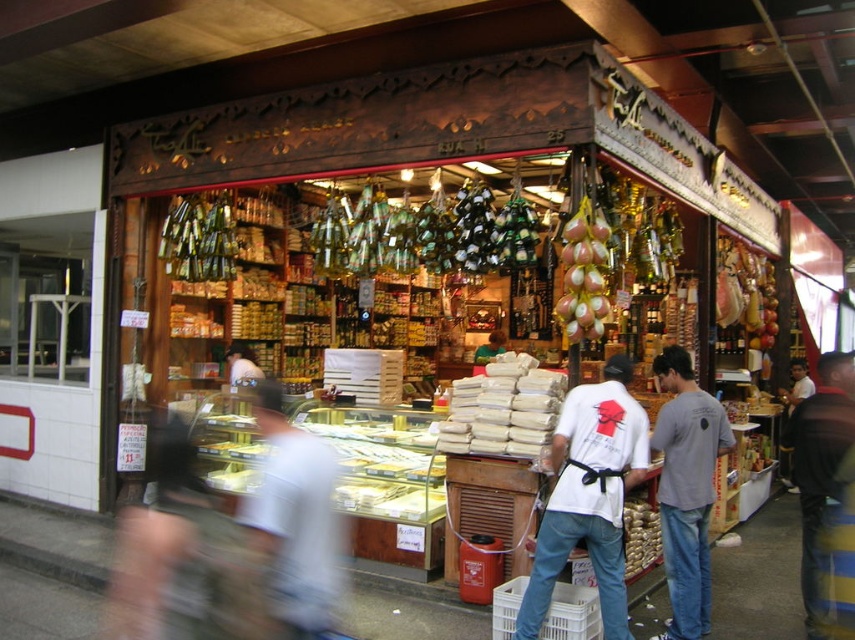
Question: Based on their relative distances, which object is nearer to the white matte food at center?

Choices:
 (A) matte white shirt at center
 (B) white matte shirt at center

Answer: (B)

Question: Which of the following is the farthest from the observer?

Choices:
 (A) dark blue jeans at lower right
 (B) white matte shirt at center
 (C) smooth brown bagel at lower center
 (D) pinkish-red glossy bananas at center

Answer: (C)

Question: Is white matte food at center smaller than smooth brown bagel at lower center?

Choices:
 (A) yes
 (B) no

Answer: (B)

Question: Is pinkish-red glossy bananas at center above smooth brown bagel at lower center?

Choices:
 (A) yes
 (B) no

Answer: (A)

Question: Is white matte shirt at center thinner than white cotton shirt at center?

Choices:
 (A) no
 (B) yes

Answer: (A)

Question: Which point is farther to the camera?

Choices:
 (A) dark blue jeans at lower right
 (B) pinkish-red glossy bananas at center
 (C) smooth brown bagel at lower center

Answer: (C)